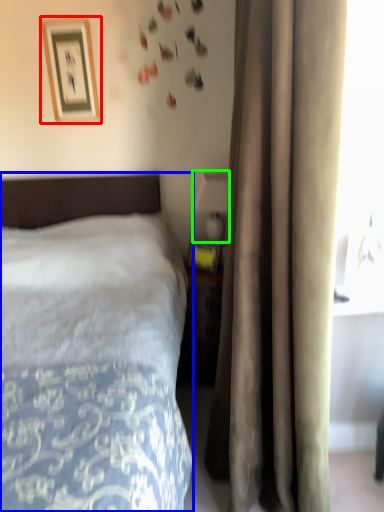
Question: Which object is positioned farthest from picture frame (highlighted by a red box)? Select from bed (highlighted by a blue box) and table lamp (highlighted by a green box).

Choices:
 (A) bed
 (B) table lamp

Answer: (A)